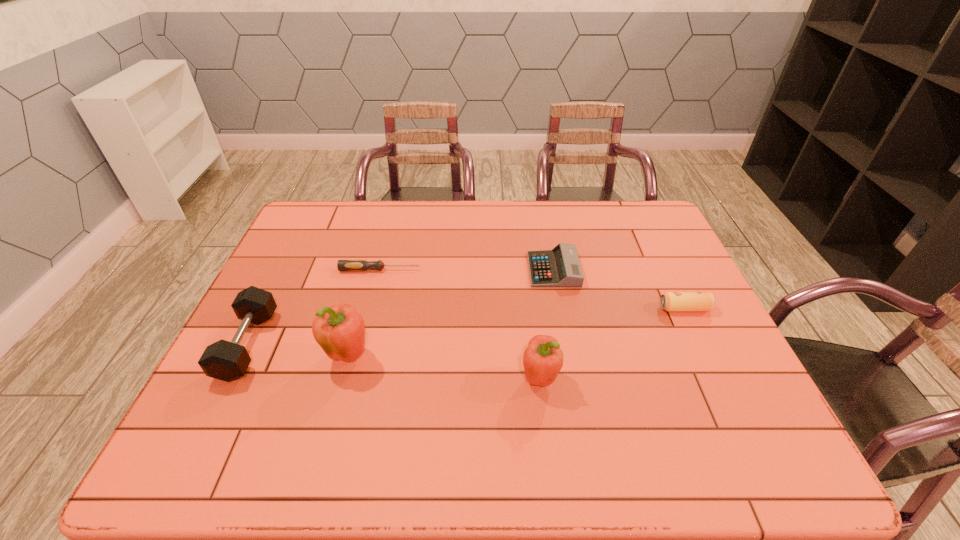
Please point a free position for a pepper on the right. Please provide its 2D coordinates. Your answer should be formatted as a tuple, i.e. [(x, y)], where the tuple contains the x and y coordinates of a point satisfying the conditions above.

[(747, 403)]